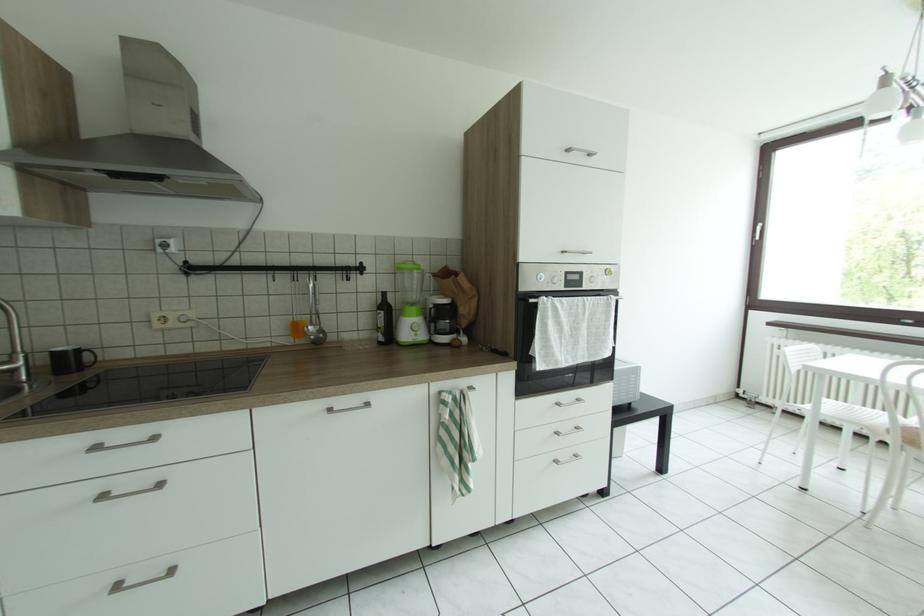
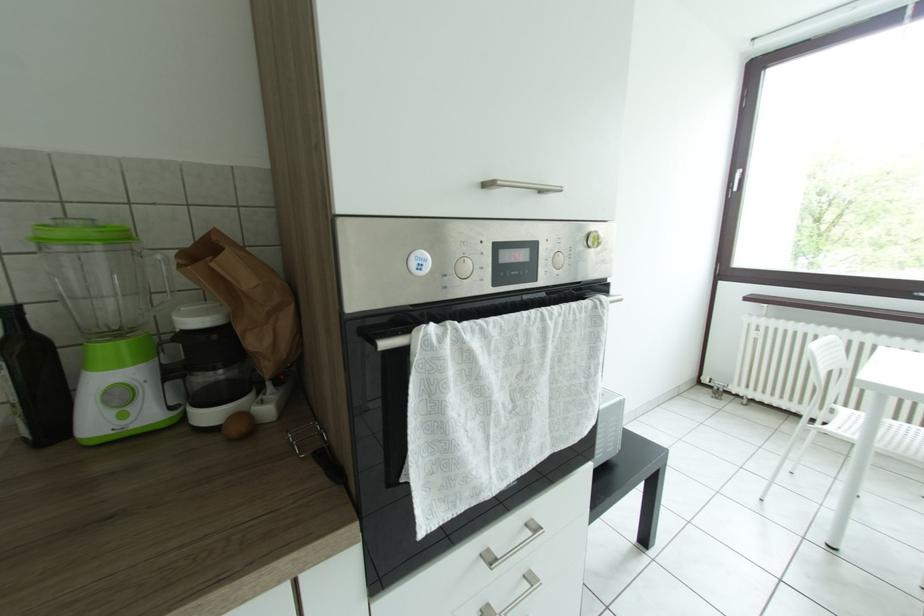
Question: In a continuous first-person perspective shot, in which direction is the camera moving?

Choices:
 (A) Left
 (B) Right
 (C) Forward
 (D) Backward

Answer: (C)